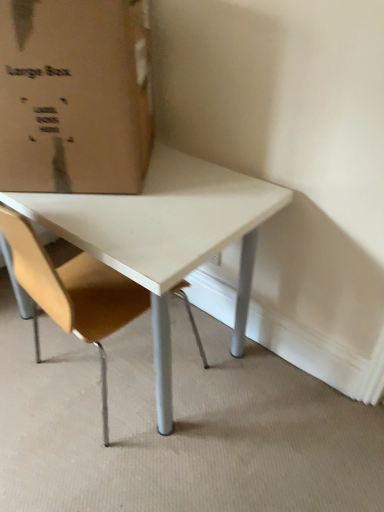
Question: Could you tell me if brown cardboard box at upper left is facing light brown leather chair at center?

Choices:
 (A) no
 (B) yes

Answer: (A)

Question: From the image's perspective, does brown cardboard box at upper left appear higher than light brown leather chair at center?

Choices:
 (A) yes
 (B) no

Answer: (A)

Question: From a real-world perspective, is brown cardboard box at upper left on light brown leather chair at center?

Choices:
 (A) yes
 (B) no

Answer: (A)

Question: Is brown cardboard box at upper left placed right next to light brown leather chair at center?

Choices:
 (A) yes
 (B) no

Answer: (B)

Question: From the image's perspective, is brown cardboard box at upper left under light brown leather chair at center?

Choices:
 (A) yes
 (B) no

Answer: (B)

Question: Does brown cardboard box at upper left have a larger size compared to light brown leather chair at center?

Choices:
 (A) no
 (B) yes

Answer: (A)

Question: Is light brown leather chair at center turned away from brown cardboard box at upper left?

Choices:
 (A) yes
 (B) no

Answer: (B)

Question: Can you confirm if light brown leather chair at center is shorter than brown cardboard box at upper left?

Choices:
 (A) yes
 (B) no

Answer: (B)

Question: Can you confirm if light brown leather chair at center is positioned to the right of brown cardboard box at upper left?

Choices:
 (A) yes
 (B) no

Answer: (A)

Question: Can you confirm if light brown leather chair at center is wider than brown cardboard box at upper left?

Choices:
 (A) yes
 (B) no

Answer: (A)

Question: From the image's perspective, is light brown leather chair at center located above brown cardboard box at upper left?

Choices:
 (A) no
 (B) yes

Answer: (A)

Question: From a real-world perspective, is light brown leather chair at center positioned over brown cardboard box at upper left based on gravity?

Choices:
 (A) no
 (B) yes

Answer: (A)

Question: From their relative heights in the image, would you say brown cardboard box at upper left is taller or shorter than light brown leather chair at center?

Choices:
 (A) tall
 (B) short

Answer: (B)